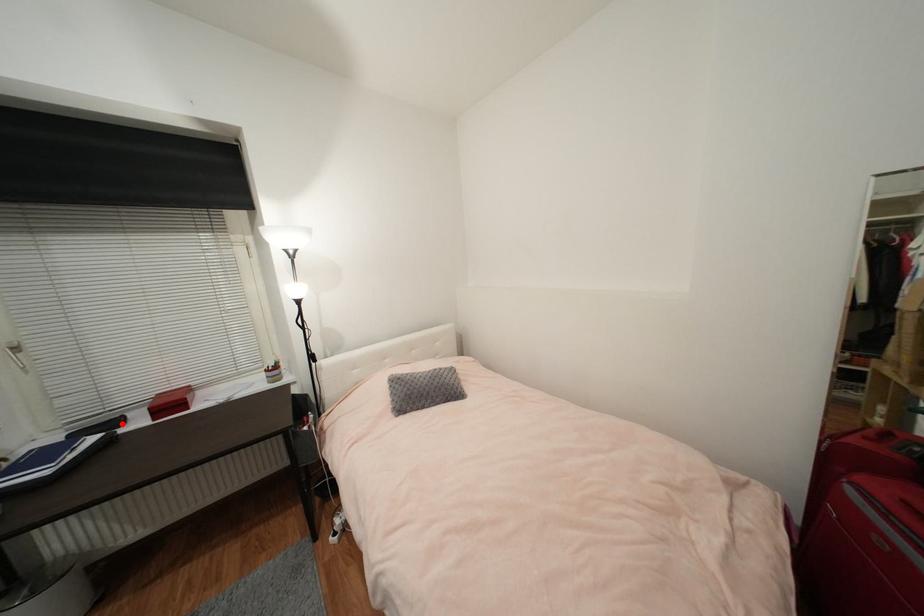
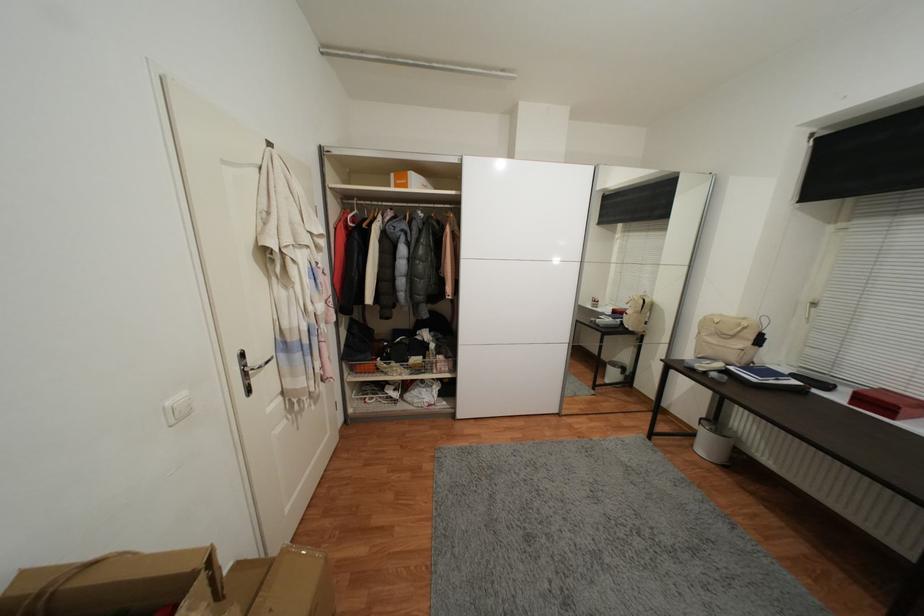
Locate, in the second image, the point that corresponds to the highlighted location in the first image.

(831, 387)